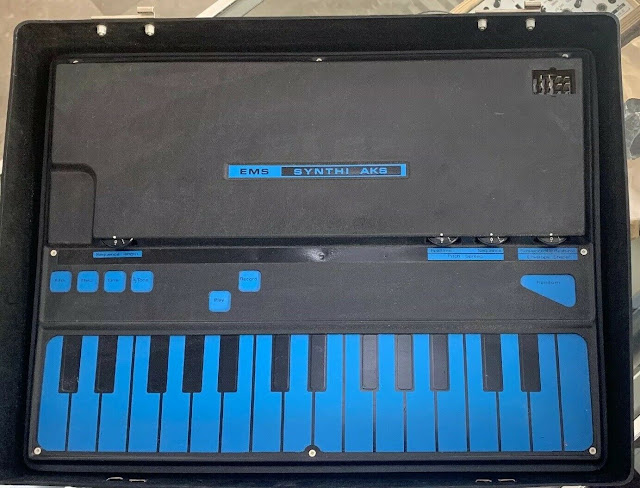
In order to click on keyboard in this screenshot , I will do `click(316, 412)`.